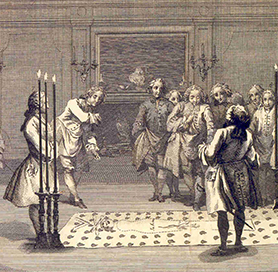
The image size is (278, 272). What are the coordinates of `1 fireplace` in the screenshot? It's located at (120, 124).